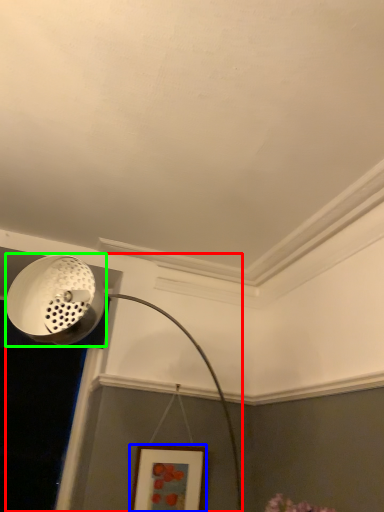
Question: Based on their relative distances, which object is farther from lamp (highlighted by a red box)? Choose from picture frame (highlighted by a blue box) and light fixture (highlighted by a green box).

Choices:
 (A) picture frame
 (B) light fixture

Answer: (A)